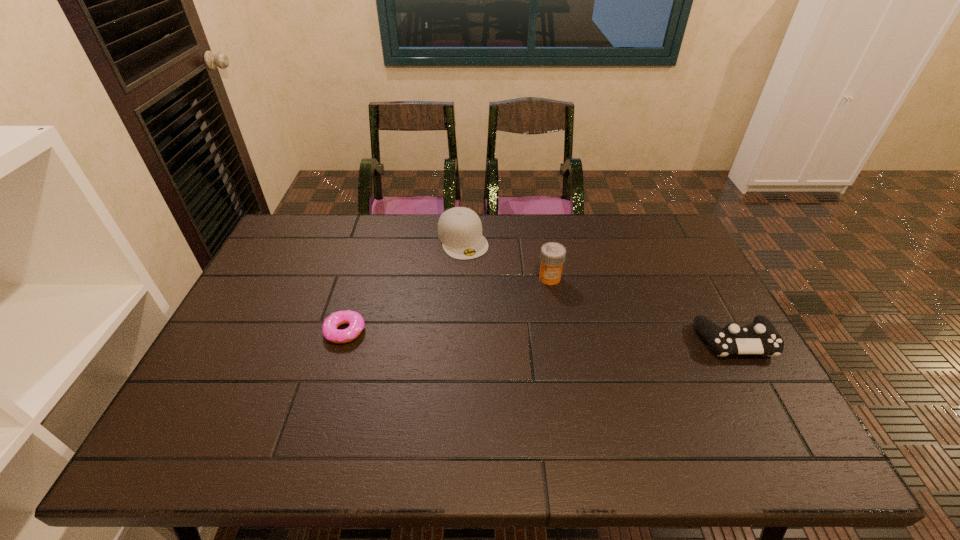
Find the location of a particular element. This screenshot has width=960, height=540. free spot located 0.310m on the label side of the third nearest object is located at coordinates tap(479, 345).

I want to click on vacant area situated 0.270m on the label side of the third nearest object, so click(488, 336).

You are a GUI agent. You are given a task and a screenshot of the screen. Output one action in this format:
    pyautogui.click(x=<x>, y=<y>)
    Task: Click on the vacant space located 0.360m on the label side of the third nearest object
    The height and width of the screenshot is (540, 960).
    Given the screenshot: What is the action you would take?
    pyautogui.click(x=467, y=357)

You are a GUI agent. You are given a task and a screenshot of the screen. Output one action in this format:
    pyautogui.click(x=<x>, y=<y>)
    Task: Click on the vacant space situated on the front-facing side of the second object from left to right
    
    Given the screenshot: What is the action you would take?
    pyautogui.click(x=490, y=295)

At what (x,y) coordinates should I click in order to perform the action: click on vacant space located on the front-facing side of the second object from left to right. Please return your answer as a coordinate pair (x, y). Image resolution: width=960 pixels, height=540 pixels. Looking at the image, I should click on (488, 291).

At what (x,y) coordinates should I click in order to perform the action: click on vacant space located 0.050m on the front-facing side of the second object from left to right. Please return your answer as a coordinate pair (x, y). Image resolution: width=960 pixels, height=540 pixels. Looking at the image, I should click on (475, 268).

Where is `object that is at the far edge`? The height and width of the screenshot is (540, 960). object that is at the far edge is located at coordinates coord(459,229).

At what (x,y) coordinates should I click in order to perform the action: click on object that is at the right edge. Please return your answer as a coordinate pair (x, y). Image resolution: width=960 pixels, height=540 pixels. Looking at the image, I should click on (761, 337).

The image size is (960, 540). I want to click on blank area at the far edge, so click(539, 224).

Identify the location of vacant space at the left edge. Image resolution: width=960 pixels, height=540 pixels. (251, 335).